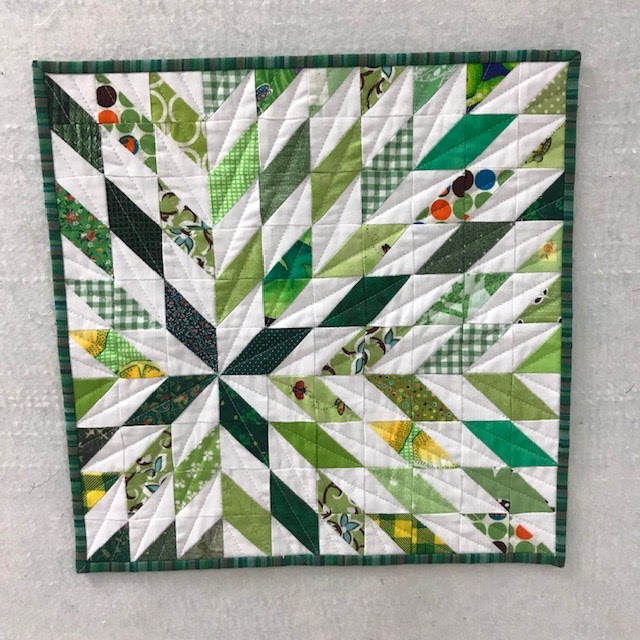
This screenshot has height=640, width=640. What are the coordinates of `space above quilt` in the screenshot? It's located at (331, 24).